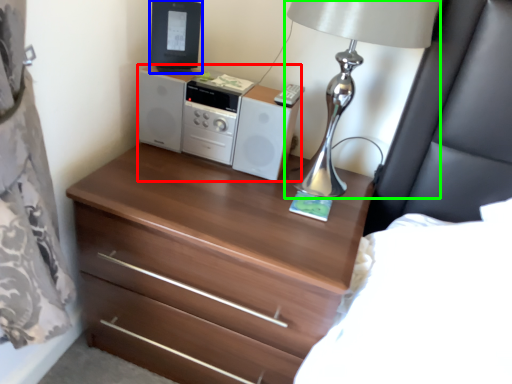
Question: Based on their relative distances, which object is farther from stereo (highlighted by a red box)? Choose from desktop computer (highlighted by a blue box) and table lamp (highlighted by a green box).

Choices:
 (A) desktop computer
 (B) table lamp

Answer: (B)